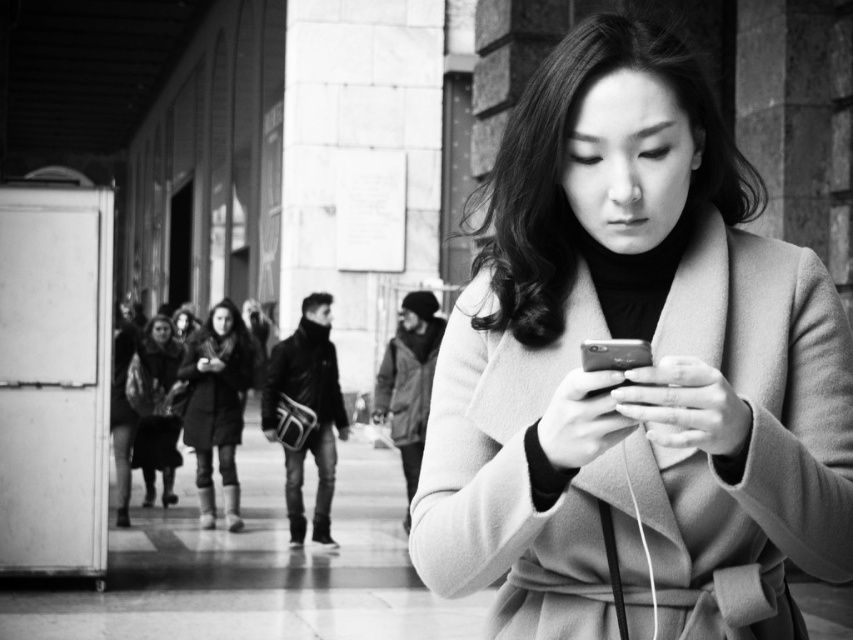
You are a GUI agent. You are given a task and a screenshot of the screen. Output one action in this format:
    pyautogui.click(x=<x>, y=<y>)
    Task: Click on the smooth beige coat at center
    
    Given the screenshot: What is the action you would take?
    [x=634, y=372]

Can you confirm if smooth beige coat at center is wider than black glossy smartphone at center?

Correct, the width of smooth beige coat at center exceeds that of black glossy smartphone at center.

Locate an element on the screen. The height and width of the screenshot is (640, 853). smooth beige coat at center is located at coordinates (634, 372).

This screenshot has width=853, height=640. Find the location of `smooth beige coat at center`. smooth beige coat at center is located at coordinates (634, 372).

Who is more distant from viewer, (212, 400) or (165, 458)?

The point (165, 458) is more distant.

This screenshot has width=853, height=640. Describe the element at coordinates (215, 387) in the screenshot. I see `dark woolen coat at center` at that location.

Where is `dark woolen coat at center`? The image size is (853, 640). dark woolen coat at center is located at coordinates (215, 387).

Is point (189, 403) less distant than point (291, 364)?

No, it is not.

Who is higher up, dark woolen coat at center or leather jacket at center?

dark woolen coat at center

Which is in front, point (209, 371) or point (286, 385)?

Point (286, 385) is in front.

The width and height of the screenshot is (853, 640). What are the coordinates of `dark woolen coat at center` in the screenshot? It's located at (215, 387).